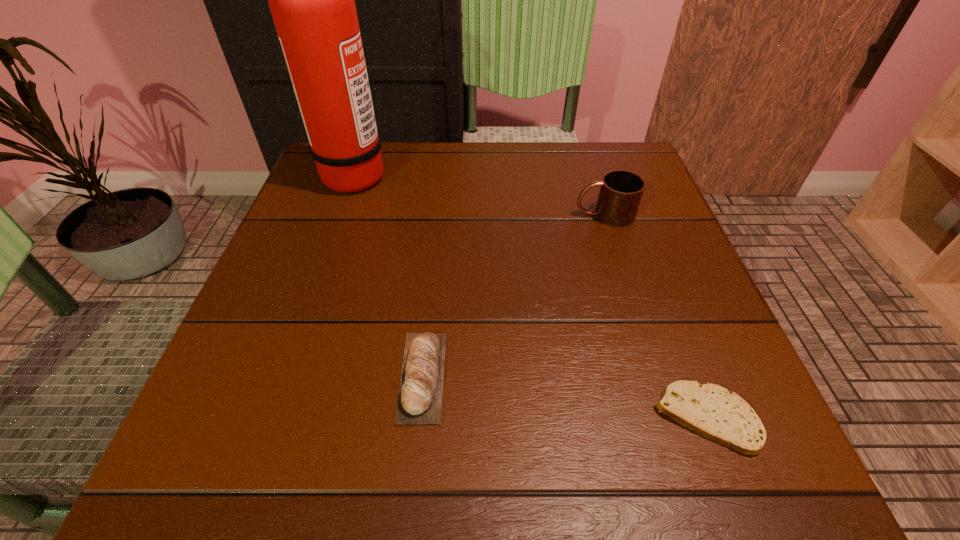
Locate an element on the screen. Image resolution: width=960 pixels, height=540 pixels. the tallest object is located at coordinates (312, 0).

Find the location of `the leftmost object`. the leftmost object is located at coordinates (312, 0).

The width and height of the screenshot is (960, 540). Find the location of `the third shortest object`. the third shortest object is located at coordinates (620, 194).

Where is `the second object from left to right`? Image resolution: width=960 pixels, height=540 pixels. the second object from left to right is located at coordinates (419, 401).

This screenshot has width=960, height=540. I want to click on the second shortest object, so click(x=419, y=401).

Where is `the shorter pita bread`? the shorter pita bread is located at coordinates (710, 410).

The height and width of the screenshot is (540, 960). Find the location of `the right pita bread`. the right pita bread is located at coordinates (710, 410).

The width and height of the screenshot is (960, 540). In order to click on blank area located 0.050m on the handle side of the leftmost object in this screenshot , I will do pos(409,174).

Image resolution: width=960 pixels, height=540 pixels. In order to click on free space located on the side of the mug with the handle in this screenshot , I will do `click(423, 215)`.

The image size is (960, 540). What are the coordinates of `vacant space located on the side of the mug with the handle` in the screenshot? It's located at (470, 215).